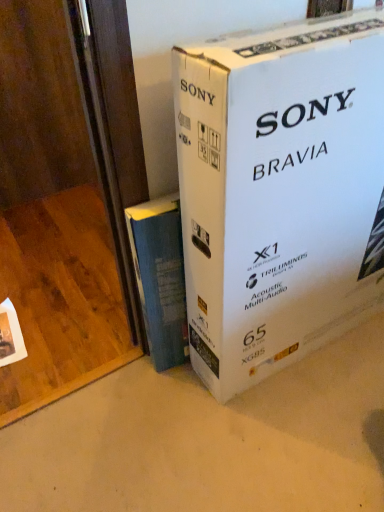
Question: Is blue fabric book at lower left wider or thinner than white cardboard box at center?

Choices:
 (A) thin
 (B) wide

Answer: (A)

Question: Is blue fabric book at lower left taller or shorter than white cardboard box at center?

Choices:
 (A) short
 (B) tall

Answer: (A)

Question: Based on their sizes in the image, would you say blue fabric book at lower left is bigger or smaller than white cardboard box at center?

Choices:
 (A) small
 (B) big

Answer: (A)

Question: In the image, is white cardboard box at center on the left side or the right side of blue fabric book at lower left?

Choices:
 (A) right
 (B) left

Answer: (A)

Question: In terms of size, does white cardboard box at center appear bigger or smaller than blue fabric book at lower left?

Choices:
 (A) big
 (B) small

Answer: (A)

Question: In terms of height, does white cardboard box at center look taller or shorter compared to blue fabric book at lower left?

Choices:
 (A) tall
 (B) short

Answer: (A)

Question: From the image's perspective, relative to blue fabric book at lower left, is white cardboard box at center above or below?

Choices:
 (A) above
 (B) below

Answer: (A)